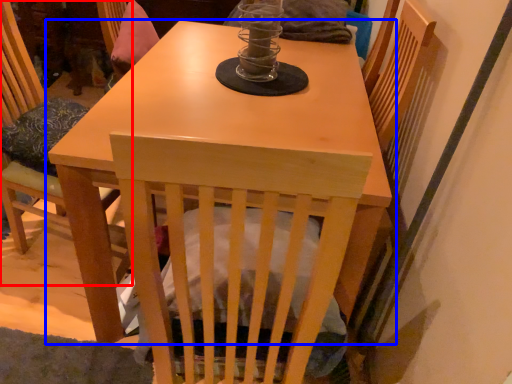
Question: Which point is closer to the camera, chair (highlighted by a red box) or table (highlighted by a blue box)?

Choices:
 (A) chair
 (B) table

Answer: (B)